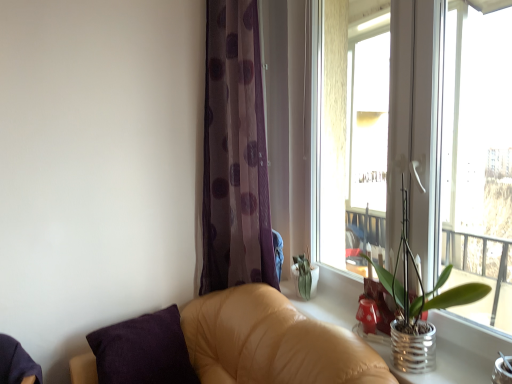
What is the approximate height of transparent glass window at upper right?

The height of transparent glass window at upper right is 4.63 feet.

This screenshot has height=384, width=512. I want to click on tan leather couch at lower right, so click(x=272, y=342).

Locate an element on the screen. The height and width of the screenshot is (384, 512). silver metallic pot at right is located at coordinates (455, 353).

Locate an element on the screen. The height and width of the screenshot is (384, 512). purple cotton pillow at lower left is located at coordinates (143, 351).

This screenshot has height=384, width=512. What do you see at coordinates (234, 153) in the screenshot?
I see `translucent purple curtain at center` at bounding box center [234, 153].

I want to click on metallic silver pot at right, so click(418, 304).

What's the angular difference between metallic silver pot at right and tan leather couch at lower right's facing directions?

0.0992 degrees separate the facing orientations of metallic silver pot at right and tan leather couch at lower right.

From the image's perspective, is metallic silver pot at right on top of tan leather couch at lower right?

Yes, from the image's perspective, metallic silver pot at right is on top of tan leather couch at lower right.

Who is bigger, metallic silver pot at right or tan leather couch at lower right?

With larger size is tan leather couch at lower right.

Is metallic silver pot at right outside of tan leather couch at lower right?

metallic silver pot at right lies outside tan leather couch at lower right's area.

Is tan leather couch at lower right turned away from silver metallic pot at right?

Yes.

How many degrees apart are the facing directions of tan leather couch at lower right and silver metallic pot at right?

tan leather couch at lower right and silver metallic pot at right are facing 1.36 degrees away from each other.

Considering the relative sizes of tan leather couch at lower right and silver metallic pot at right in the image provided, is tan leather couch at lower right taller than silver metallic pot at right?

Correct, tan leather couch at lower right is much taller as silver metallic pot at right.

Can you confirm if metallic silver pot at right is wider than purple cotton pillow at lower left?

No, metallic silver pot at right is not wider than purple cotton pillow at lower left.

Is metallic silver pot at right facing away from purple cotton pillow at lower left?

That's not correct — metallic silver pot at right is not looking away from purple cotton pillow at lower left.

From the image's perspective, between metallic silver pot at right and purple cotton pillow at lower left, which one is located above?

From the image's view, metallic silver pot at right is above.

From a real-world perspective, relative to purple cotton pillow at lower left, is metallic silver pot at right vertically above or below?

In terms of real-world spatial position, metallic silver pot at right is above purple cotton pillow at lower left.

From the image's perspective, which one is positioned lower, translucent purple curtain at center or silver metallic pot at right?

From the image's view, silver metallic pot at right is below.

Find the location of a particular element. The image size is (512, 384). curtain behind the silver metallic pot at right is located at coordinates (234, 153).

Relative to silver metallic pot at right, is translucent purple curtain at center in front or behind?

Visually, translucent purple curtain at center is located behind silver metallic pot at right.

Considering the relative positions of tan leather couch at lower right and transparent glass window at upper right in the image provided, is tan leather couch at lower right to the left of transparent glass window at upper right from the viewer's perspective?

Correct, you'll find tan leather couch at lower right to the left of transparent glass window at upper right.

How different are the orientations of tan leather couch at lower right and transparent glass window at upper right in degrees?

The angle between the facing direction of tan leather couch at lower right and the facing direction of transparent glass window at upper right is 1.25 degrees.

From a real-world perspective, is tan leather couch at lower right beneath transparent glass window at upper right?

Yes, from a real-world perspective, tan leather couch at lower right is under transparent glass window at upper right.

Does metallic silver pot at right have a smaller size compared to silver metallic pot at right?

Actually, metallic silver pot at right might be larger than silver metallic pot at right.

This screenshot has height=384, width=512. I want to click on window sill that is behind the metallic silver pot at right, so click(455, 353).

Considering the positions of objects metallic silver pot at right and silver metallic pot at right in the image provided, who is more to the right, metallic silver pot at right or silver metallic pot at right?

metallic silver pot at right is more to the right.

From a real-world perspective, is metallic silver pot at right located beneath silver metallic pot at right?

No, from a real-world perspective, metallic silver pot at right is not beneath silver metallic pot at right.

Where is `studio couch on the left of the transparent glass window at upper right`? This screenshot has height=384, width=512. studio couch on the left of the transparent glass window at upper right is located at coordinates (272, 342).

Looking at this image, from a real-world perspective, is transparent glass window at upper right beneath tan leather couch at lower right?

Incorrect, from a real-world perspective, transparent glass window at upper right is higher than tan leather couch at lower right.

Is tan leather couch at lower right inside transparent glass window at upper right?

That's incorrect, tan leather couch at lower right is not inside transparent glass window at upper right.

Which of these two, transparent glass window at upper right or tan leather couch at lower right, stands taller?

Answer: With more height is transparent glass window at upper right.

In order to click on houseplant above the tan leather couch at lower right (from the image's perspective) in this screenshot , I will do `click(418, 304)`.

Locate an element on the screen. The width and height of the screenshot is (512, 384). studio couch below the silver metallic pot at right (from a real-world perspective) is located at coordinates (272, 342).

Estimate the real-world distances between objects in this image. Which object is further from transparent glass window at upper right, translucent purple curtain at center or silver metallic pot at right?

translucent purple curtain at center lies further to transparent glass window at upper right than the other object.

From the image, which object appears to be nearer to metallic silver pot at right, purple cotton pillow at lower left or silver metallic pot at right?

silver metallic pot at right lies closer to metallic silver pot at right than the other object.

Estimate the real-world distances between objects in this image. Which object is closer to purple cotton pillow at lower left, metallic silver pot at right or transparent glass window at upper right?

The object closer to purple cotton pillow at lower left is metallic silver pot at right.

Estimate the real-world distances between objects in this image. Which object is further from metallic silver pot at right, purple cotton pillow at lower left or translucent purple curtain at center?

purple cotton pillow at lower left.

Considering their positions, is metallic silver pot at right positioned closer to tan leather couch at lower right than silver metallic pot at right?

The object closer to tan leather couch at lower right is silver metallic pot at right.

Estimate the real-world distances between objects in this image. Which object is further from translucent purple curtain at center, transparent glass window at upper right or purple cotton pillow at lower left?

transparent glass window at upper right lies further to translucent purple curtain at center than the other object.

Which object lies nearer to the anchor point transparent glass window at upper right, purple cotton pillow at lower left or tan leather couch at lower right?

tan leather couch at lower right is closer to transparent glass window at upper right.

Looking at the image, which one is located further to metallic silver pot at right, translucent purple curtain at center or purple cotton pillow at lower left?

purple cotton pillow at lower left is further to metallic silver pot at right.

You are a GUI agent. You are given a task and a screenshot of the screen. Output one action in this format:
    pyautogui.click(x=<x>, y=<y>)
    Task: Click on the window sill located between purple cotton pillow at lower left and metallic silver pot at right in the left-right direction
    
    Given the screenshot: What is the action you would take?
    pyautogui.click(x=455, y=353)

Identify the location of houseplant between translucent purple curtain at center and silver metallic pot at right in the up-down direction. (418, 304).

Identify the location of curtain between purple cotton pillow at lower left and metallic silver pot at right. (234, 153).

The image size is (512, 384). In order to click on window sill situated between tan leather couch at lower right and metallic silver pot at right from left to right in this screenshot , I will do `click(455, 353)`.